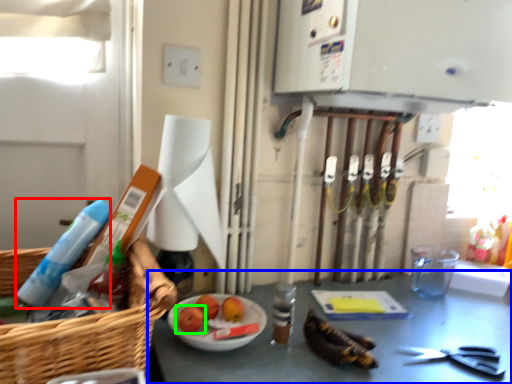
Question: Which object is the closest to the cleaning product (highlighted by a red box)? Choose among these: table (highlighted by a blue box) or fruit (highlighted by a green box).

Choices:
 (A) table
 (B) fruit

Answer: (B)